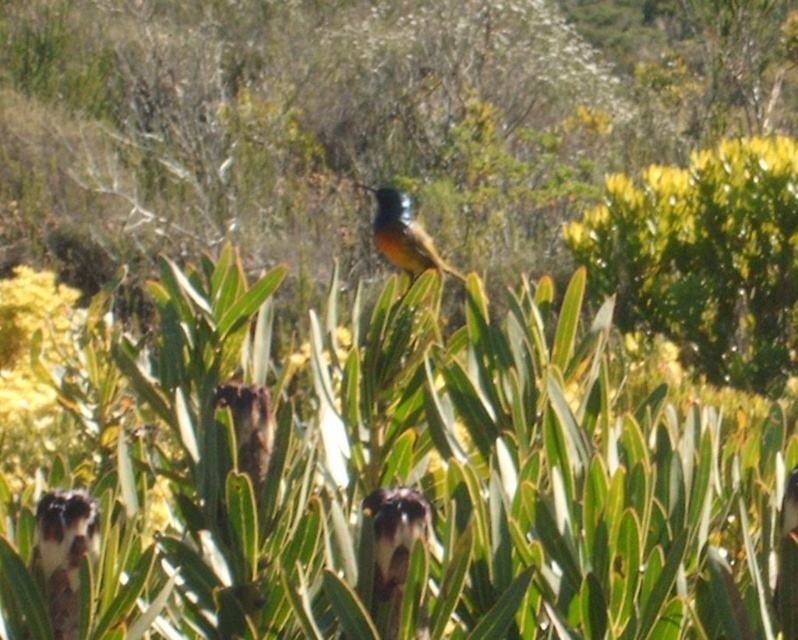
You are a photographer trying to capture the bird on the green leafy bush at upper right. Based on the coordinates provided, where should you aim your camera to ensure the bird is centered in your shot?

The green leafy bush at upper right is located at coordinates point [704,257], so you should aim your camera at that point to center the bird in your shot.

You are a birdwatcher observing the scene. You see the shiny blue bird at center and the green leafy bush at upper right. Which object is positioned to the right of the other?

The green leafy bush at upper right is positioned to the right of the shiny blue bird at center.

You are a birdwatcher trying to photograph the small bird on the protea plant. You notice two points in the image labeled as point 1 at coordinates point (749, 241) and point 2 at coordinates point (409, 224). Which point is closer to the bird?

Point 2 at coordinates point (409, 224) is closer to the bird because point 1 at coordinates point (749, 241) is behind it.